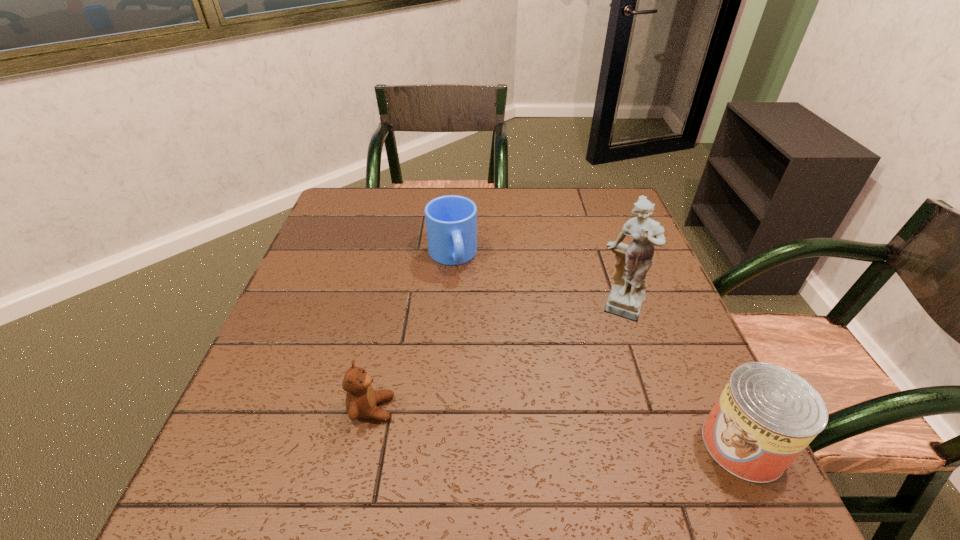
Where is `free spot between the teddy bear and the can`? This screenshot has height=540, width=960. free spot between the teddy bear and the can is located at coordinates (558, 427).

You are a GUI agent. You are given a task and a screenshot of the screen. Output one action in this format:
    pyautogui.click(x=<x>, y=<y>)
    Task: Click on the vacant space in between the teddy bear and the farthest object
    
    Given the screenshot: What is the action you would take?
    pyautogui.click(x=412, y=332)

This screenshot has width=960, height=540. Identify the location of free space between the second object from left to right and the teddy bear. (412, 332).

Find the location of `vacant space that is in between the leftmost object and the third object from right to left`. vacant space that is in between the leftmost object and the third object from right to left is located at coordinates (412, 332).

At what (x,y) coordinates should I click in order to perform the action: click on free spot between the tallest object and the teddy bear. Please return your answer as a coordinate pair (x, y). Looking at the image, I should click on click(x=497, y=359).

Select which object is the closest to the teddy bear. Please provide its 2D coordinates. Your answer should be formatted as a tuple, i.e. [(x, y)], where the tuple contains the x and y coordinates of a point satisfying the conditions above.

[(451, 221)]

Locate an element on the screen. object that can be found as the closest to the rightmost object is located at coordinates (633, 261).

Where is `free space that satisfies the following two spatial constraints: 1. on the front side of the can; 2. on the left side of the mug`? Image resolution: width=960 pixels, height=540 pixels. free space that satisfies the following two spatial constraints: 1. on the front side of the can; 2. on the left side of the mug is located at coordinates pos(438,445).

This screenshot has width=960, height=540. In order to click on vacant region that satisfies the following two spatial constraints: 1. on the front side of the rightmost object; 2. on the left side of the mug in this screenshot , I will do `click(438, 445)`.

Identify the location of vacant space that satisfies the following two spatial constraints: 1. on the front side of the second object from right to left; 2. on the right side of the third object from right to left. (448, 308).